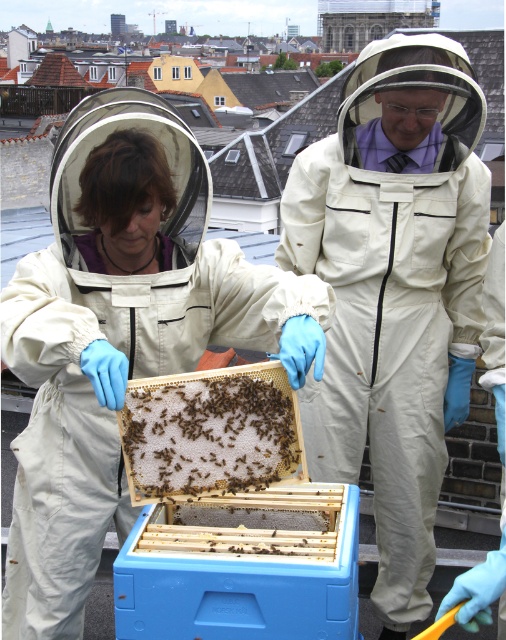
Question: Which point appears farthest from the camera in this image?

Choices:
 (A) (268, 467)
 (B) (100, 172)

Answer: (B)

Question: Is the position of white fabric beekeeper suit at center more distant than that of brown fuzzy honeycomb at center?

Choices:
 (A) yes
 (B) no

Answer: (A)

Question: Which point is closer to the camera?

Choices:
 (A) (232, 449)
 (B) (333, 150)
 (C) (130, 134)
 (D) (274, 480)

Answer: (A)

Question: Is beige fabric beekeeper suit at center wider than brown fuzzy honeycomb at center?

Choices:
 (A) no
 (B) yes

Answer: (B)

Question: Which point is closer to the camera?

Choices:
 (A) click(67, 310)
 (B) click(351, 561)
 (C) click(298, 451)

Answer: (B)

Question: Can you confirm if beige fabric beekeeper suit at center is bigger than brown wax comb at center?

Choices:
 (A) yes
 (B) no

Answer: (A)